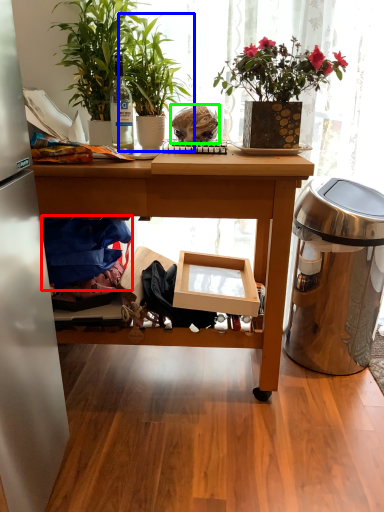
Question: Which is farther away from clothing (highlighted by a red box)? houseplant (highlighted by a blue box) or food (highlighted by a green box)?

Choices:
 (A) houseplant
 (B) food

Answer: (B)